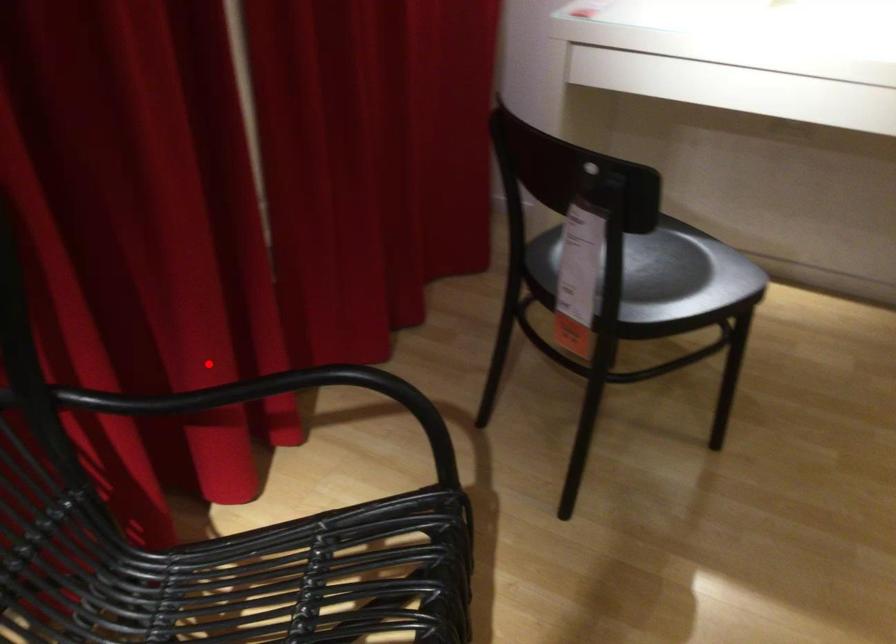
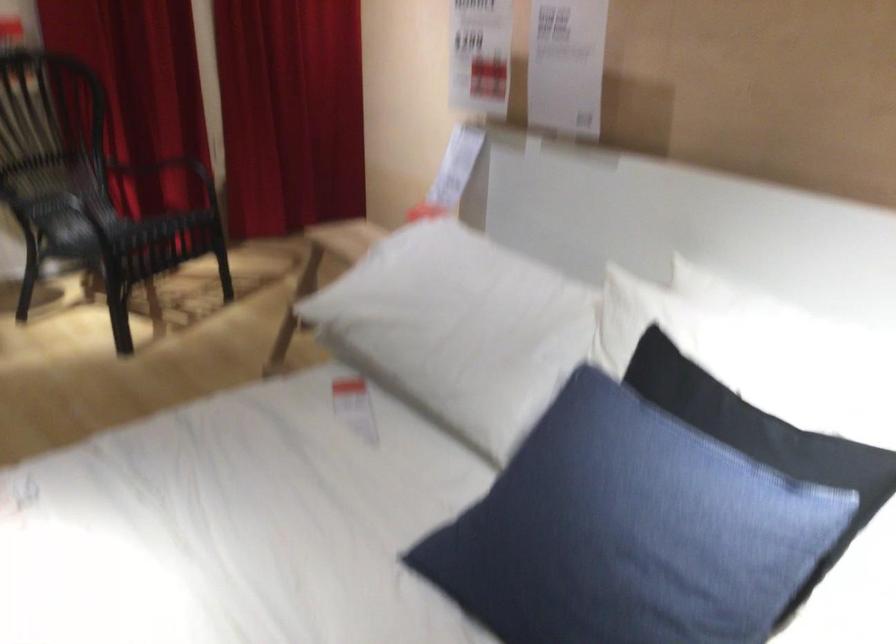
Question: A red point is marked in image1. In image2, is the corresponding 3D point closer to the camera or farther? Reply with the corresponding letter.

Choices:
 (A) The corresponding 3D point is closer.
 (B) The corresponding 3D point is farther.

Answer: (B)